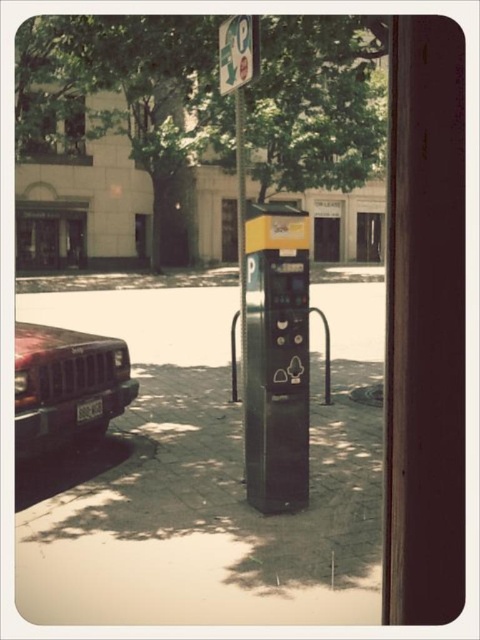
Question: Is concrete pavement at center closer to camera compared to metallic parking sign at upper center?

Choices:
 (A) yes
 (B) no

Answer: (A)

Question: Among these points, which one is nearest to the camera?

Choices:
 (A) (242, 58)
 (B) (194, 531)

Answer: (B)

Question: Which point is farther to the camera?

Choices:
 (A) (232, 64)
 (B) (267, 410)
 (C) (338, 524)
 (D) (75, 416)

Answer: (D)

Question: Which point appears farthest from the camera in this image?

Choices:
 (A) (301, 244)
 (B) (96, 397)
 (C) (223, 92)
 (D) (55, 580)

Answer: (B)

Question: Is black plastic parking meter at center closer to camera compared to white plastic license plate at lower left?

Choices:
 (A) yes
 (B) no

Answer: (A)

Question: Can you confirm if concrete pavement at center is positioned below white plastic license plate at lower left?

Choices:
 (A) no
 (B) yes

Answer: (B)